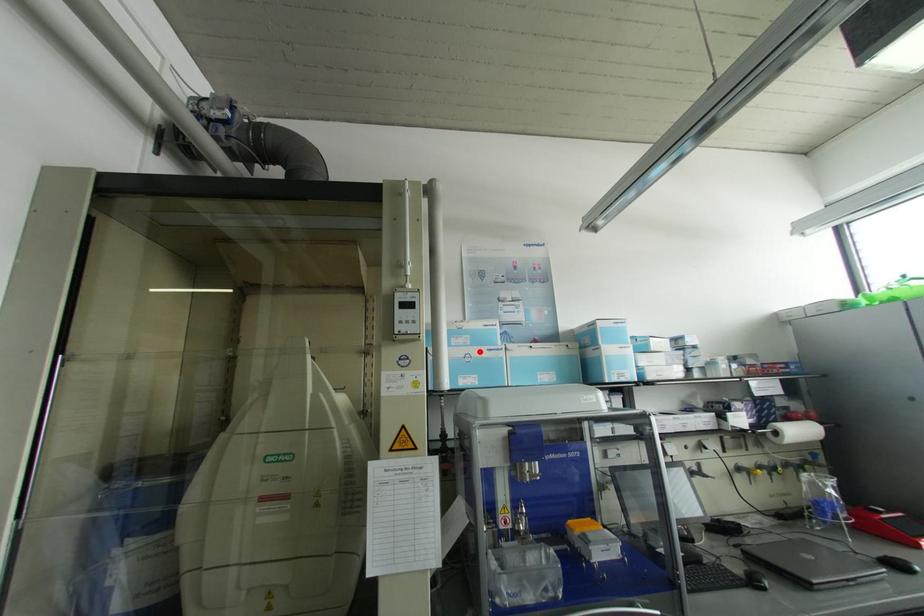
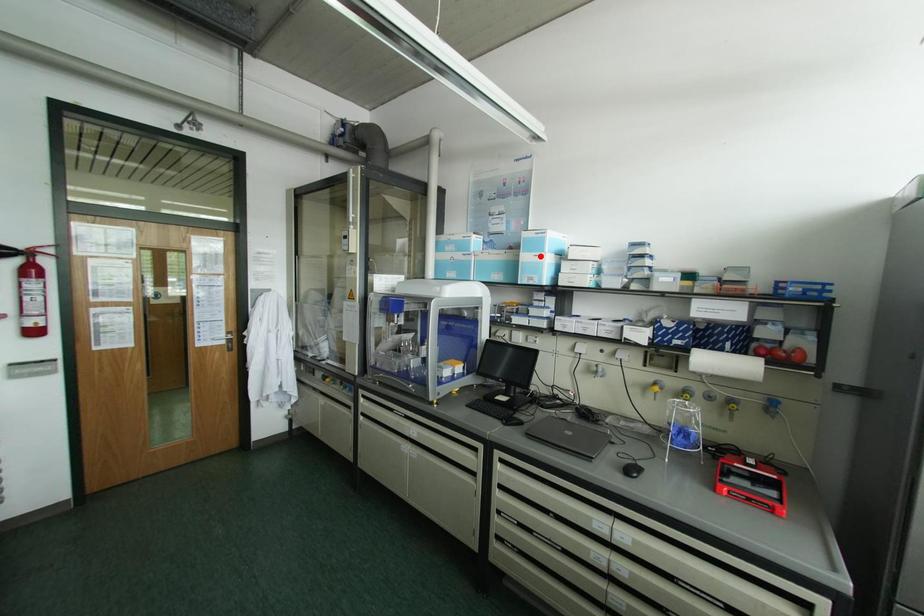
I am providing you with two images of the same scene from different viewpoints. A red point is marked on the first image and another point is marked on the second image. Does the point marked in image1 correspond to the same location as the one in image2?

No